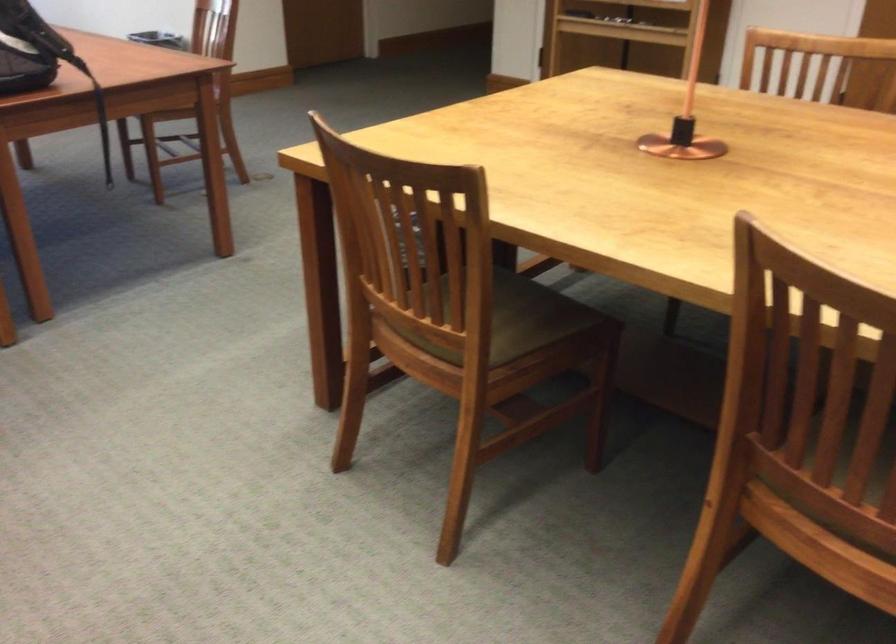
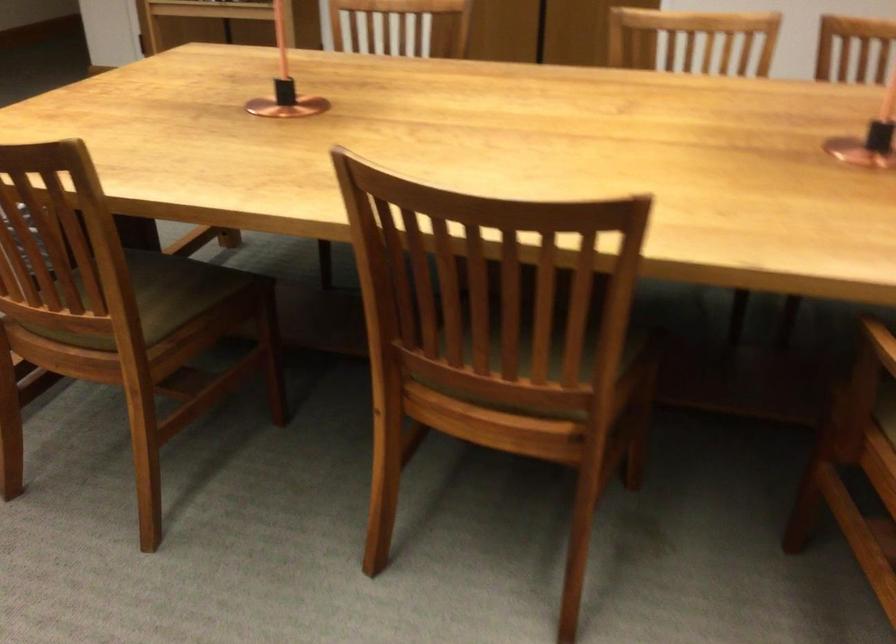
Find the pixel in the second image that matches [511,321] in the first image.

(159, 297)